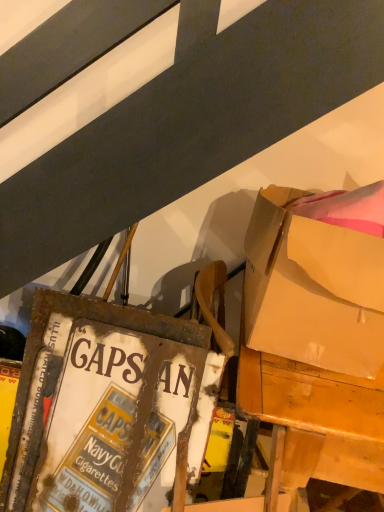
Find the location of `matte cardboard box at upper right`. matte cardboard box at upper right is located at coordinates (317, 277).

From a real-world perspective, is wooden desk at right on rusty metal signboard at lower left?

Actually, wooden desk at right is physically below rusty metal signboard at lower left in the real world.

Measure the distance between wooden desk at right and rusty metal signboard at lower left.

wooden desk at right and rusty metal signboard at lower left are 16.62 inches apart.

Is wooden desk at right in front of or behind rusty metal signboard at lower left in the image?

Clearly, wooden desk at right is in front of rusty metal signboard at lower left.

Can you tell me how much wooden desk at right and rusty metal signboard at lower left differ in facing direction?

3.63 degrees separate the facing orientations of wooden desk at right and rusty metal signboard at lower left.

Is wooden desk at right oriented towards matte cardboard box at upper right?

No, wooden desk at right is not turned towards matte cardboard box at upper right.

Between wooden desk at right and matte cardboard box at upper right, which one has smaller size?

Smaller between the two is matte cardboard box at upper right.

From a real-world perspective, relative to matte cardboard box at upper right, is wooden desk at right vertically above or below?

In terms of real-world spatial position, wooden desk at right is below matte cardboard box at upper right.

Which of these two, wooden desk at right or matte cardboard box at upper right, is wider?

wooden desk at right.

Does matte cardboard box at upper right have a greater height compared to rusty metal signboard at lower left?

In fact, matte cardboard box at upper right may be shorter than rusty metal signboard at lower left.

Is matte cardboard box at upper right positioned before rusty metal signboard at lower left?

Yes, it is.

Is rusty metal signboard at lower left located within matte cardboard box at upper right?

No, matte cardboard box at upper right does not contain rusty metal signboard at lower left.

From a real-world perspective, who is located lower, matte cardboard box at upper right or wooden desk at right?

From a 3D spatial view, wooden desk at right is below.

Considering the relative positions of matte cardboard box at upper right and wooden desk at right in the image provided, is matte cardboard box at upper right to the right of wooden desk at right from the viewer's perspective?

In fact, matte cardboard box at upper right is to the left of wooden desk at right.

Is matte cardboard box at upper right bigger or smaller than wooden desk at right?

Considering their sizes, matte cardboard box at upper right takes up less space than wooden desk at right.

From the image's perspective, which one is positioned higher, matte cardboard box at upper right or wooden desk at right?

From the image's view, matte cardboard box at upper right is above.

In terms of size, does rusty metal signboard at lower left appear bigger or smaller than matte cardboard box at upper right?

rusty metal signboard at lower left is bigger than matte cardboard box at upper right.

Is rusty metal signboard at lower left beside matte cardboard box at upper right?

No, rusty metal signboard at lower left is not beside matte cardboard box at upper right.

Based on the photo, considering the sizes of objects rusty metal signboard at lower left and matte cardboard box at upper right in the image provided, who is taller, rusty metal signboard at lower left or matte cardboard box at upper right?

With more height is rusty metal signboard at lower left.

Would you say rusty metal signboard at lower left is outside matte cardboard box at upper right?

That's correct, rusty metal signboard at lower left is outside of matte cardboard box at upper right.

From the picture: Is rusty metal signboard at lower left next to wooden desk at right and touching it?

No, rusty metal signboard at lower left is not beside wooden desk at right.

The height and width of the screenshot is (512, 384). What are the coordinates of `paperback book above the wooden desk at right (from the image's perspective)` in the screenshot? It's located at (101, 406).

Considering the relative positions of rusty metal signboard at lower left and wooden desk at right in the image provided, is rusty metal signboard at lower left in front of wooden desk at right?

No, the depth of rusty metal signboard at lower left is greater than that of wooden desk at right.

Is point (7, 509) less distant than point (293, 470)?

No.

Locate an element on the screen. This screenshot has height=512, width=384. desk located on the right of rusty metal signboard at lower left is located at coordinates (x=314, y=422).

Identify the location of desk located underneath the matte cardboard box at upper right (from a real-world perspective). (314, 422).

From the image, which object appears to be nearer to matte cardboard box at upper right, rusty metal signboard at lower left or wooden desk at right?

Among the two, wooden desk at right is located nearer to matte cardboard box at upper right.

Which object lies nearer to the anchor point wooden desk at right, matte cardboard box at upper right or rusty metal signboard at lower left?

Among the two, matte cardboard box at upper right is located nearer to wooden desk at right.

Looking at the image, which one is located closer to matte cardboard box at upper right, wooden desk at right or rusty metal signboard at lower left?

Based on the image, wooden desk at right appears to be nearer to matte cardboard box at upper right.

When comparing their distances from rusty metal signboard at lower left, does wooden desk at right or matte cardboard box at upper right seem further?

The object further to rusty metal signboard at lower left is matte cardboard box at upper right.

Estimate the real-world distances between objects in this image. Which object is further from rusty metal signboard at lower left, matte cardboard box at upper right or wooden desk at right?

matte cardboard box at upper right.

From the image, which object appears to be nearer to wooden desk at right, rusty metal signboard at lower left or matte cardboard box at upper right?

Based on the image, matte cardboard box at upper right appears to be nearer to wooden desk at right.

You are a GUI agent. You are given a task and a screenshot of the screen. Output one action in this format:
    pyautogui.click(x=<x>, y=<y>)
    Task: Click on the box between rusty metal signboard at lower left and wooden desk at right from left to right
    
    Given the screenshot: What is the action you would take?
    pyautogui.click(x=317, y=277)